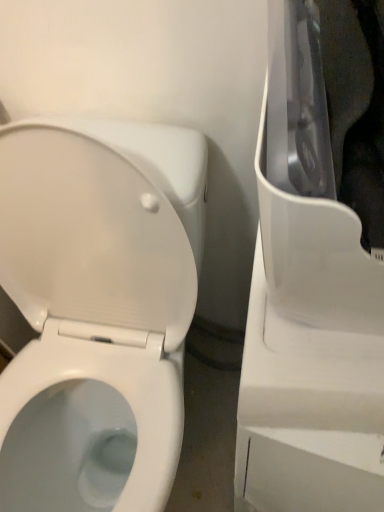
Question: In terms of width, does white glossy toilet at left look wider or thinner when compared to white plastic appliance at right?

Choices:
 (A) wide
 (B) thin

Answer: (A)

Question: In the image, is white glossy toilet at left positioned in front of or behind white plastic appliance at right?

Choices:
 (A) behind
 (B) front

Answer: (A)

Question: From the image's perspective, is white glossy toilet at left located above or below white plastic appliance at right?

Choices:
 (A) below
 (B) above

Answer: (B)

Question: Looking at their shapes, would you say white plastic appliance at right is wider or thinner than white glossy toilet at left?

Choices:
 (A) thin
 (B) wide

Answer: (A)

Question: In terms of size, does white plastic appliance at right appear bigger or smaller than white glossy toilet at left?

Choices:
 (A) small
 (B) big

Answer: (A)

Question: From a real-world perspective, is white plastic appliance at right positioned above or below white glossy toilet at left?

Choices:
 (A) above
 (B) below

Answer: (A)

Question: Relative to white glossy toilet at left, is white plastic appliance at right in front or behind?

Choices:
 (A) front
 (B) behind

Answer: (A)